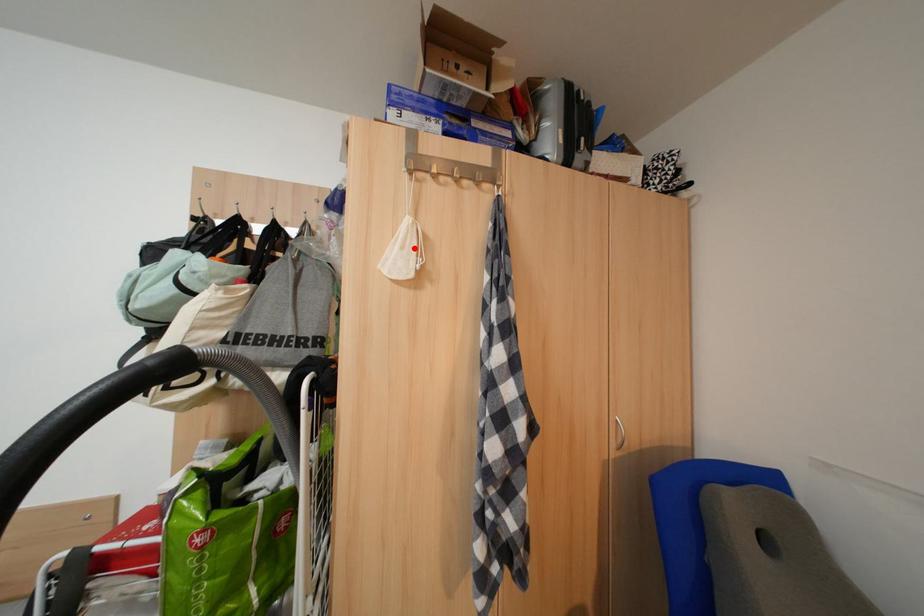
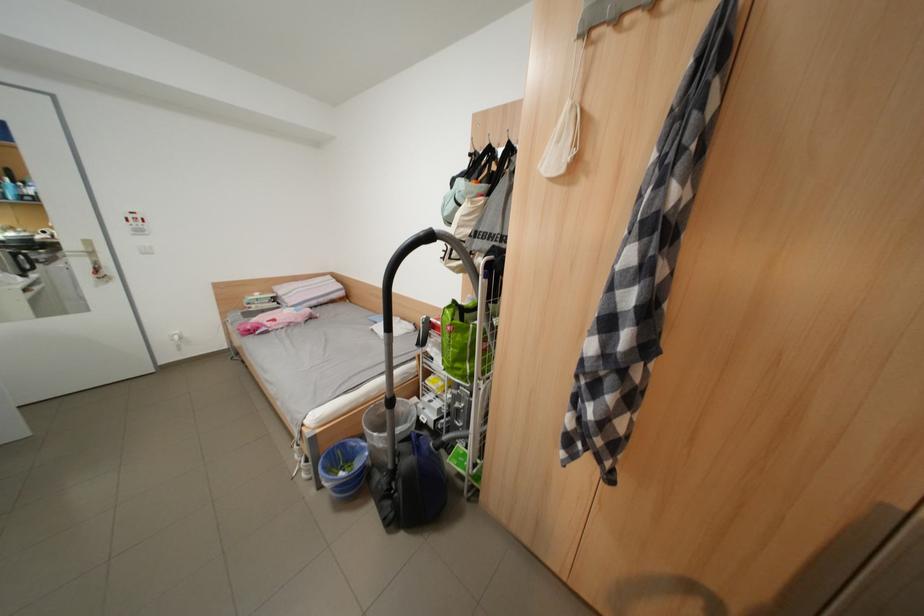
Find the pixel in the second image that matches the highlighted location in the first image.

(569, 142)